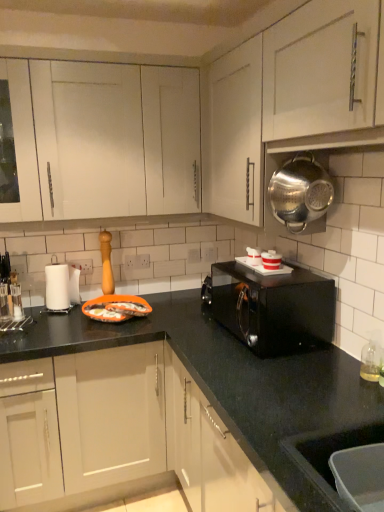
Question: From the image's perspective, would you say matte white cabinets at center, arranged as the 1th cabinetry when ordered from the bottom, is positioned over white plastic container at center, which is the 2th appliance from top to bottom?

Choices:
 (A) no
 (B) yes

Answer: (A)

Question: Is the surface of matte white cabinets at center, arranged as the 1th cabinetry when ordered from the bottom, in direct contact with white plastic container at center, the 3th appliance when ordered from front to back?

Choices:
 (A) no
 (B) yes

Answer: (A)

Question: Is matte white cabinets at center, the second cabinetry viewed from the top, positioned beyond the bounds of white plastic container at center, the third appliance from the right?

Choices:
 (A) no
 (B) yes

Answer: (B)

Question: Is matte white cabinets at center, the second cabinetry viewed from the top, shorter than white plastic container at center, marked as the second appliance in a left-to-right arrangement?

Choices:
 (A) yes
 (B) no

Answer: (B)

Question: Is matte white cabinets at center, the second cabinetry viewed from the top, positioned far away from white plastic container at center, the 3th appliance when ordered from front to back?

Choices:
 (A) no
 (B) yes

Answer: (B)

Question: Considering the relative positions of matte white cabinets at center, arranged as the 1th cabinetry when ordered from the bottom, and white plastic container at center, the third appliance from the right, in the image provided, is matte white cabinets at center, arranged as the 1th cabinetry when ordered from the bottom, to the left of white plastic container at center, the third appliance from the right, from the viewer's perspective?

Choices:
 (A) yes
 (B) no

Answer: (A)

Question: Is there a large distance between matte white cabinets at center, the second cabinetry viewed from the top, and white paper towel at left, the 1th appliance in the bottom-to-top sequence?

Choices:
 (A) no
 (B) yes

Answer: (A)

Question: Considering the relative sizes of matte white cabinets at center, arranged as the 1th cabinetry when ordered from the bottom, and white paper towel at left, which is the 1th appliance in back-to-front order, in the image provided, is matte white cabinets at center, arranged as the 1th cabinetry when ordered from the bottom, bigger than white paper towel at left, which is the 1th appliance in back-to-front order,?

Choices:
 (A) no
 (B) yes

Answer: (B)

Question: Is matte white cabinets at center, arranged as the 1th cabinetry when ordered from the bottom, behind white paper towel at left, the 1th appliance in the bottom-to-top sequence?

Choices:
 (A) yes
 (B) no

Answer: (B)

Question: Is matte white cabinets at center, the second cabinetry viewed from the top, with white paper towel at left, which is counted as the 1th appliance, starting from the left?

Choices:
 (A) no
 (B) yes

Answer: (A)

Question: Is matte white cabinets at center, arranged as the 1th cabinetry when ordered from the bottom, surrounding white paper towel at left, which ranks as the fourth appliance in right-to-left order?

Choices:
 (A) yes
 (B) no

Answer: (B)

Question: Does matte white cabinets at center, arranged as the 1th cabinetry when ordered from the bottom, have a greater height compared to white paper towel at left, acting as the 4th appliance starting from the front?

Choices:
 (A) no
 (B) yes

Answer: (B)

Question: Can white glossy microwave at upper right, the 2th appliance viewed from the front, be found inside matte white cabinets at center, the second cabinetry viewed from the top?

Choices:
 (A) no
 (B) yes

Answer: (A)